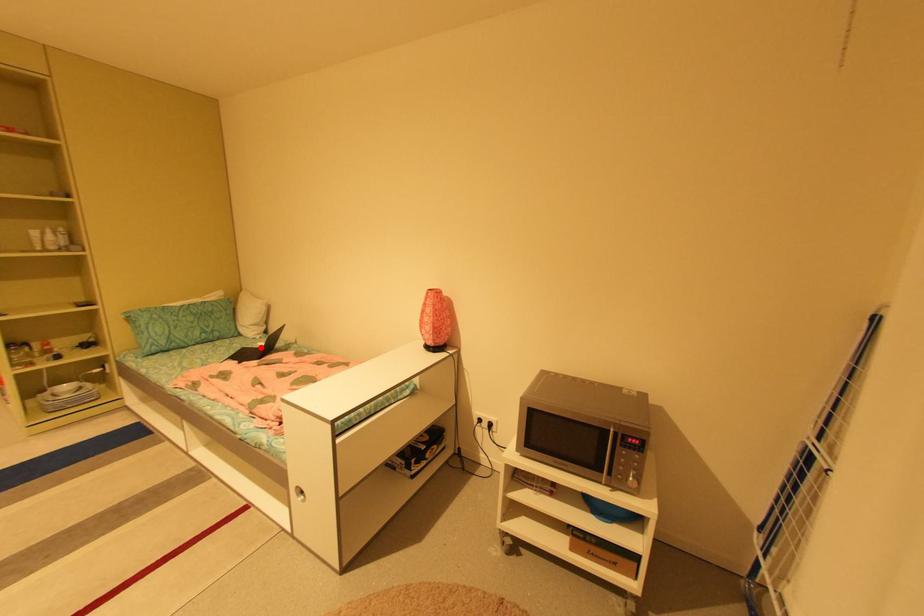
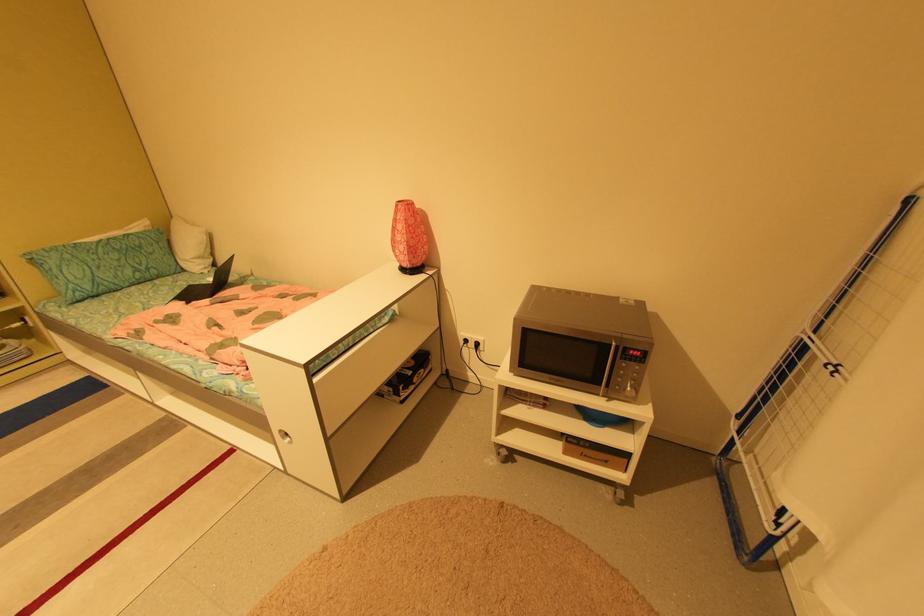
In the second image, find the point that corresponds to the highlighted location in the first image.

(210, 284)